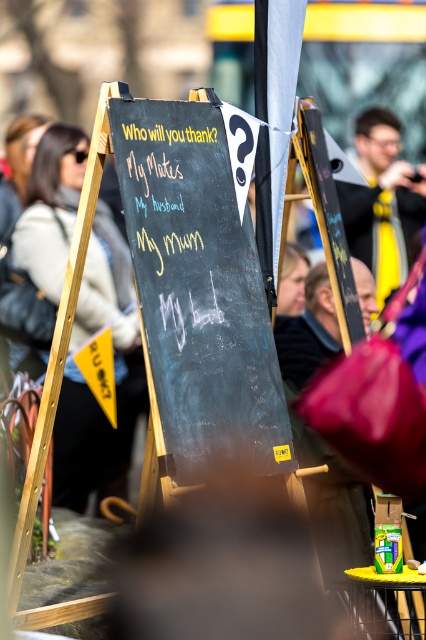
You are organizing a community event and need to display two important signs. The black chalkboard at center and the matte black sign at left must be positioned so that the one above is visible to attendees entering from the front. Based on their current arrangement, which object should you place higher to ensure proper visibility?

The black chalkboard at center is already located above the matte black sign at left, so it is already positioned higher and should remain there for proper visibility.

What are the coordinates of the black chalkboard at center?

The black chalkboard at center is located at point (198, 292).

You are standing in front of the black chalkboard at center and want to place a flower bouquet on the matte black sign at left. Can you reach the sign without moving your position?

The black chalkboard at center is closer to the viewer than the matte black sign at left, so the matte black sign at left is further away. Since you are standing in front of the black chalkboard at center, you cannot reach the matte black sign at left without moving your position.